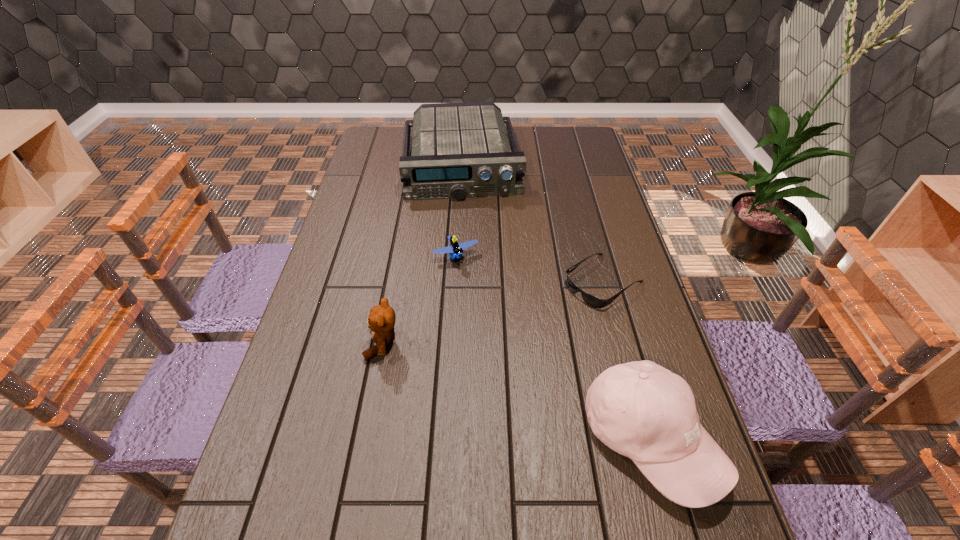
Locate which object ranks fourth in proximity to the teddy bear. Please provide its 2D coordinates. Your answer should be formatted as a tuple, i.e. [(x, y)], where the tuple contains the x and y coordinates of a point satisfying the conditions above.

[(459, 150)]

Choose which object is the third nearest neighbor to the baseball cap. Please provide its 2D coordinates. Your answer should be formatted as a tuple, i.e. [(x, y)], where the tuple contains the x and y coordinates of a point satisfying the conditions above.

[(381, 321)]

Image resolution: width=960 pixels, height=540 pixels. I want to click on free region that satisfies the following two spatial constraints: 1. on the front side of the baseball cap; 2. on the front-facing side of the fourth tallest object, so click(446, 438).